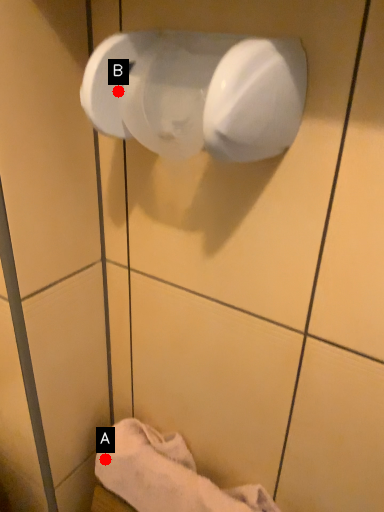
Question: Two points are circled on the image, labeled by A and B beside each circle. Among these points, which one is farthest from the camera?

Choices:
 (A) A is further
 (B) B is further

Answer: (A)